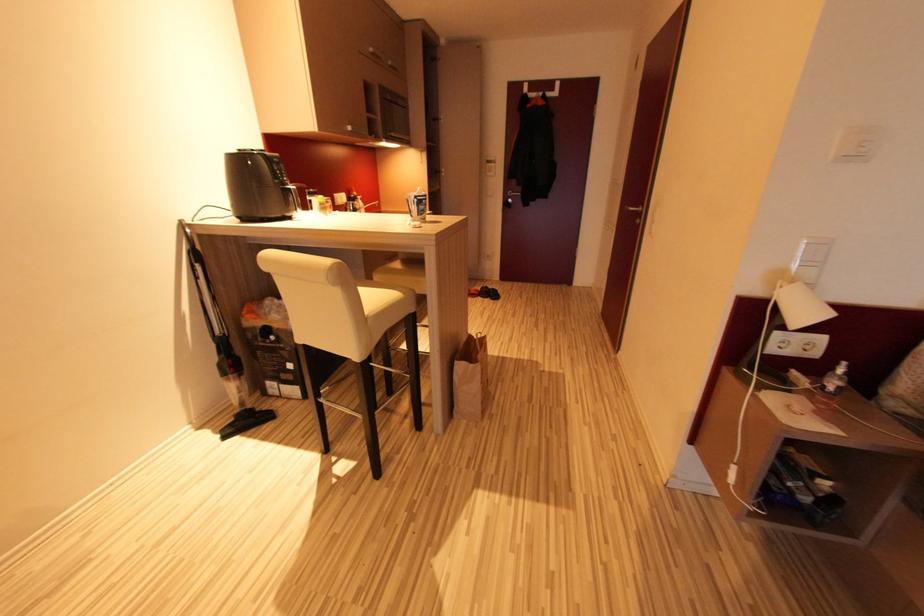
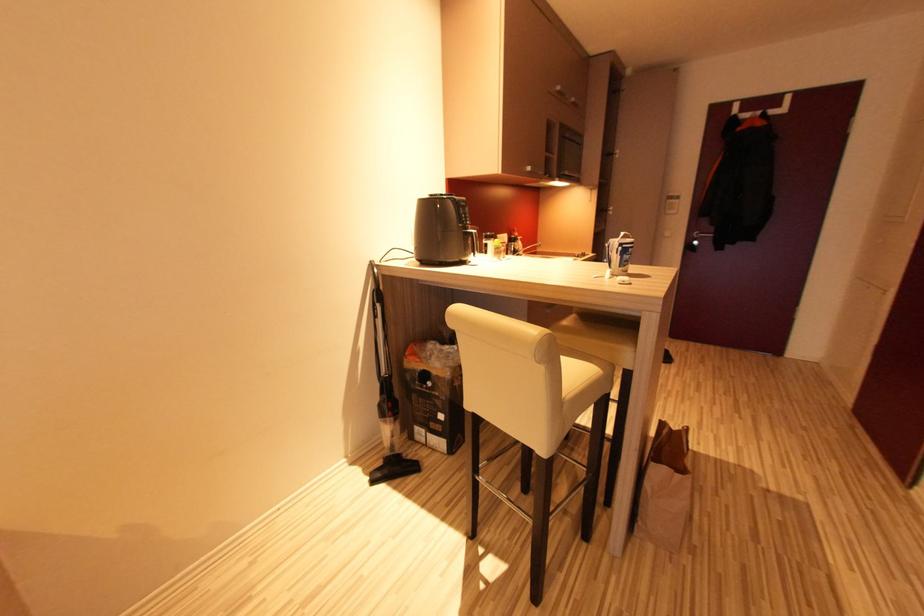
Question: The camera is either moving clockwise (left) or counter-clockwise (right) around the object. The first image is from the beginning of the video and the second image is from the end. Is the camera moving left or right when shooting the video?

Choices:
 (A) Left
 (B) Right

Answer: (B)